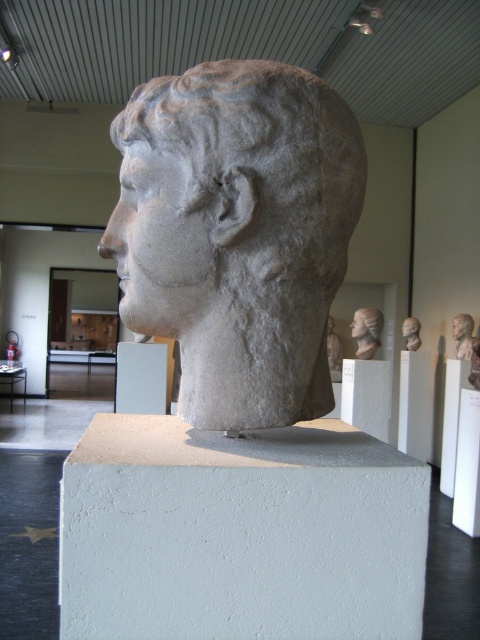
You are standing at the camera position in the museum and want to place a 2 meter long ladder between the white concrete block at center and the camera. Is there enough space to place the ladder horizontally between them?

The white concrete block at center and camera are 6.42 meters apart from each other, so yes, the ladder can be placed horizontally between them since the distance is greater than the ladder length.

From the picture: You are an art conservator needing to move the white marble head at center and the matte stone bust at center to a new exhibition space. The path between them is 6.20 meters. If your cart can carry both objects but requires at least 5 meters of space to maneuver, is the distance sufficient?

The distance between the white marble head at center and the matte stone bust at center is 6.20 meters, which is more than the required 5 meters of space needed for maneuvering. Therefore, the distance is sufficient for moving both objects together on the cart.

You are standing in the museum and want to place a small statue on the floor. The statue requires a stable surface exactly at the center of the room. Is there an object at point (141, 378) that can support it?

The point (141, 378) indicates a white concrete block at center, so yes, the statue can be placed there as it provides a stable surface at the specified coordinates.